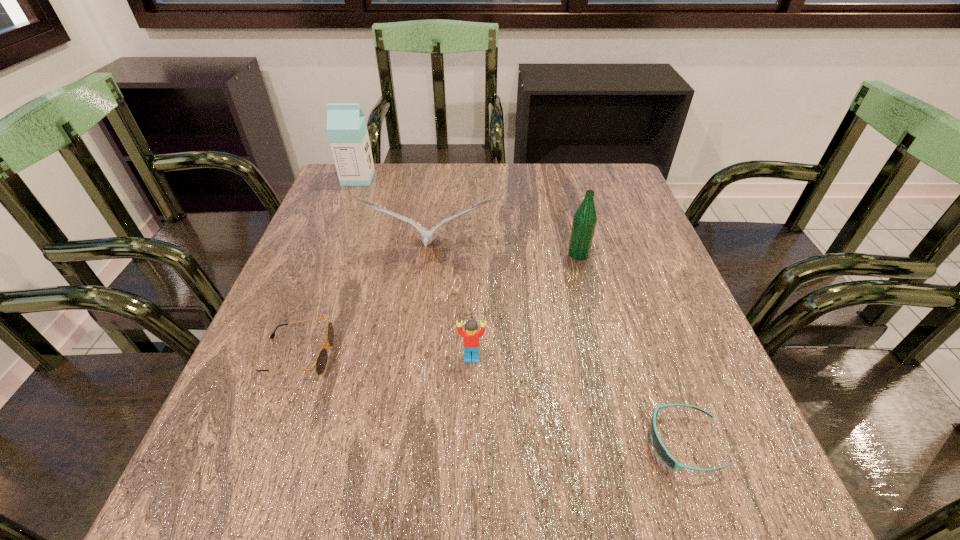
What are the coordinates of `vacant space that is in between the left sunglasses and the nearer sunglasses` in the screenshot? It's located at (491, 399).

Find the location of a particular element. This screenshot has height=540, width=960. free spot between the left sunglasses and the gull is located at coordinates (364, 304).

You are a GUI agent. You are given a task and a screenshot of the screen. Output one action in this format:
    pyautogui.click(x=<x>, y=<y>)
    Task: Click on the free spot between the nearest object and the fourth tallest object
    This screenshot has height=540, width=960.
    Given the screenshot: What is the action you would take?
    pyautogui.click(x=578, y=400)

The image size is (960, 540). I want to click on blank region between the nearer sunglasses and the left sunglasses, so click(x=491, y=399).

The width and height of the screenshot is (960, 540). I want to click on free spot between the milk carton and the Lego, so click(x=415, y=268).

The image size is (960, 540). Identify the location of vacant area that lies between the Lego and the left sunglasses. (385, 356).

Locate an element on the screen. Image resolution: width=960 pixels, height=540 pixels. free space between the gull and the left sunglasses is located at coordinates (364, 304).

The image size is (960, 540). I want to click on free spot between the fifth object from left to right and the nearer sunglasses, so click(x=632, y=348).

Locate an element on the screen. vacant region between the Lego and the nearest object is located at coordinates (578, 400).

Identify the location of object that is the second closest one to the tallest object. This screenshot has height=540, width=960. 321,361.